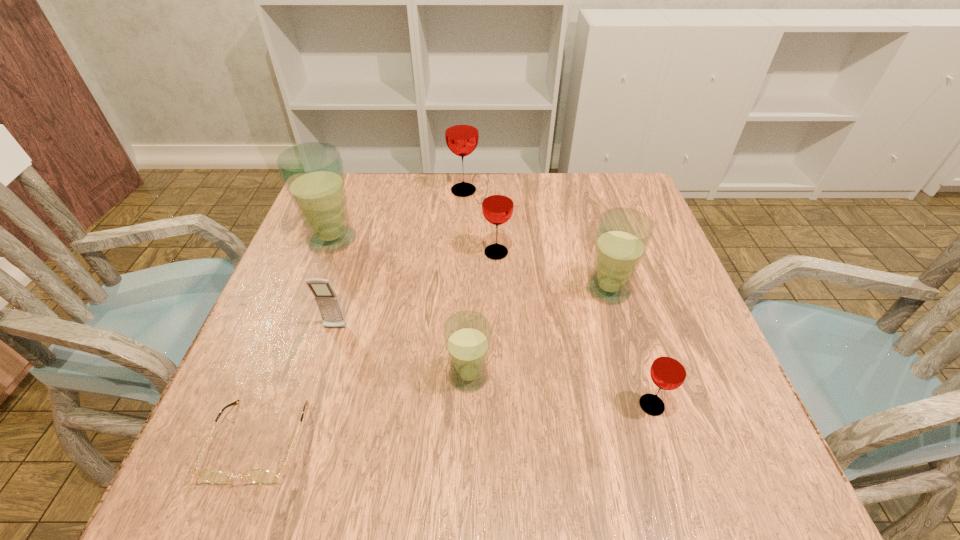
Find the location of `free space at the left edge`. free space at the left edge is located at coordinates (242, 399).

This screenshot has width=960, height=540. Identify the location of free space at the right edge. [595, 232].

This screenshot has height=540, width=960. I want to click on vacant region at the near left corner, so click(x=283, y=443).

This screenshot has width=960, height=540. I want to click on vacant space that's between the smallest blue glass and the second red glass from right to left, so click(483, 314).

The image size is (960, 540). I want to click on free space between the second red glass from left to right and the smallest red glass, so click(x=574, y=329).

Identify the location of free space between the fourth farthest glass and the rightmost red glass. (630, 347).

This screenshot has height=540, width=960. I want to click on free space between the second smallest red glass and the smallest blue glass, so click(x=483, y=314).

The image size is (960, 540). In order to click on vacant area that lies between the green spectacles and the second farthest blue glass in this screenshot , I will do `click(434, 365)`.

This screenshot has width=960, height=540. In order to click on vacant area that lies between the cellular telephone and the leftmost blue glass in this screenshot , I will do (334, 284).

Identify the location of vacant region between the third nearest glass and the biggest red glass. The height and width of the screenshot is (540, 960). (536, 240).